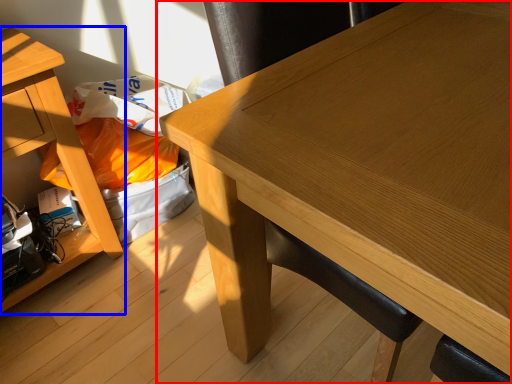
Question: Which object appears closest to the camera in this image, table (highlighted by a red box) or table (highlighted by a blue box)?

Choices:
 (A) table
 (B) table

Answer: (A)